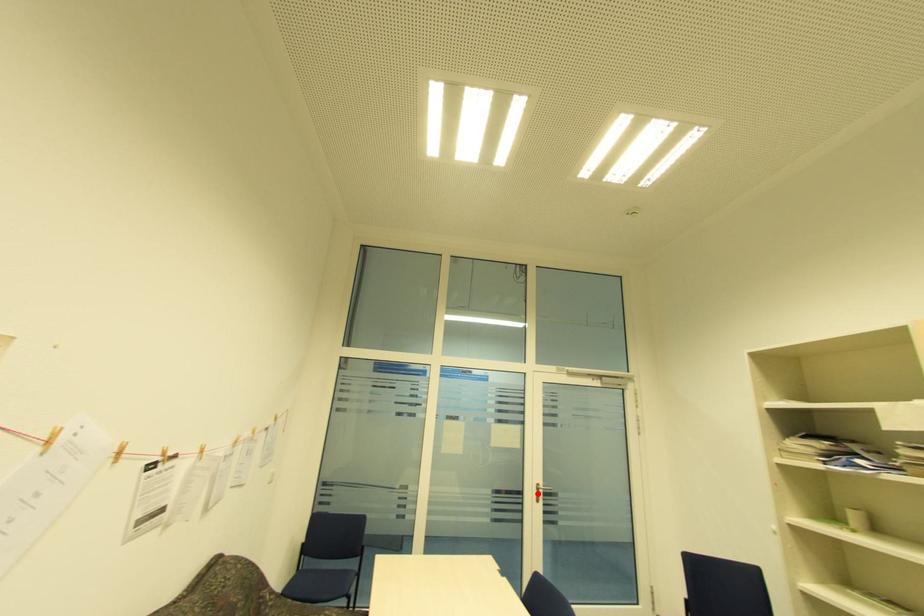
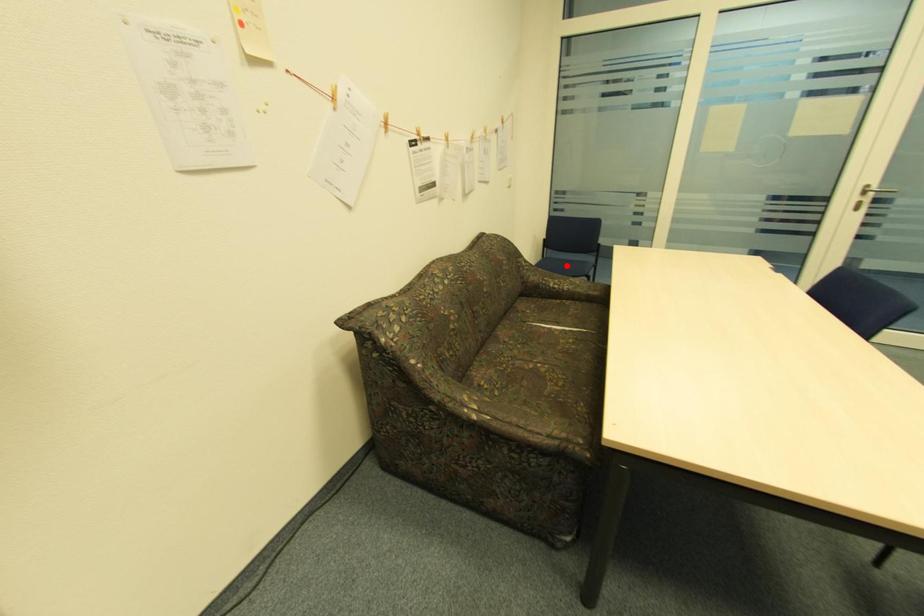
I am providing you with two images of the same scene from different viewpoints. A red point is marked on the first image and another point is marked on the second image. Is the marked point in image1 the same physical position as the marked point in image2?

No